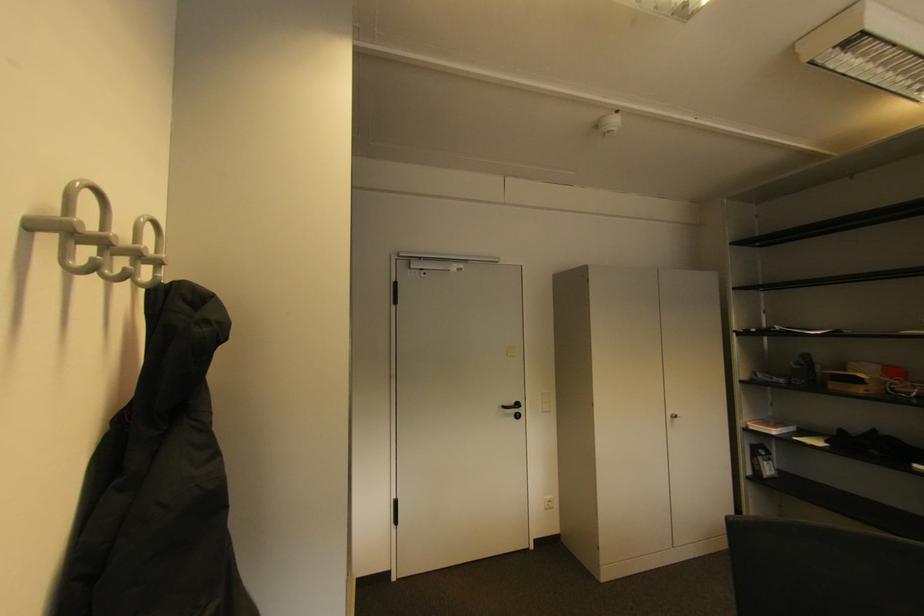
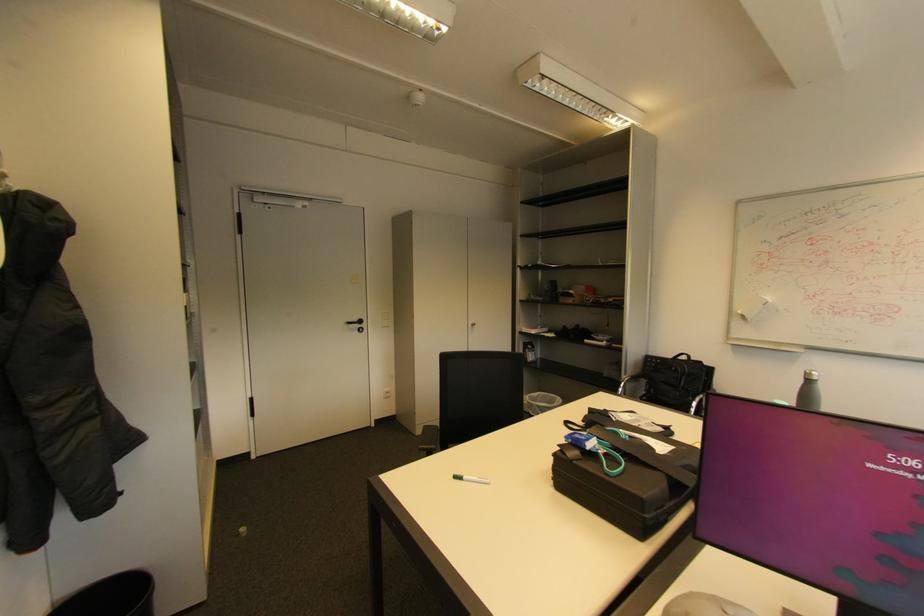
In the second image, find the point that corresponds to (523,406) in the first image.

(366, 322)